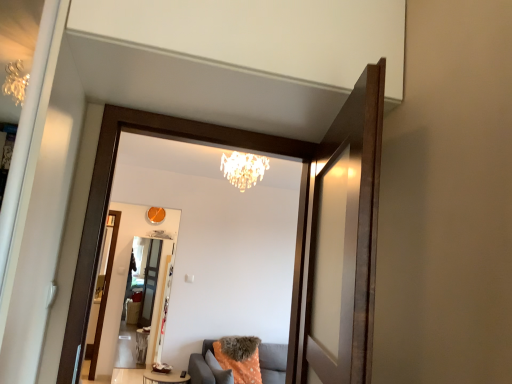
Question: From a real-world perspective, is matte wooden mirror at center positioned above or below transparent glass screen door at upper center, acting as the 2th screen door starting from the bottom?

Choices:
 (A) below
 (B) above

Answer: (A)

Question: In terms of size, does matte wooden mirror at center appear bigger or smaller than transparent glass screen door at upper center, acting as the 2th screen door starting from the bottom?

Choices:
 (A) big
 (B) small

Answer: (A)

Question: Which of these objects is positioned closest to the transparent glass screen door at upper center, which is counted as the first screen door, starting from the right?

Choices:
 (A) wooden round table at center
 (B) clear glass screen door at center, the second screen door in the front-to-back sequence
 (C) crystal chandelier at upper center
 (D) matte wooden mirror at center

Answer: (C)

Question: Which is nearer to the crystal chandelier at upper center?

Choices:
 (A) clear glass screen door at center, placed as the second screen door when sorted from right to left
 (B) transparent glass screen door at upper center, which is the first screen door in front-to-back order
 (C) wooden round table at center
 (D) matte wooden mirror at center

Answer: (D)